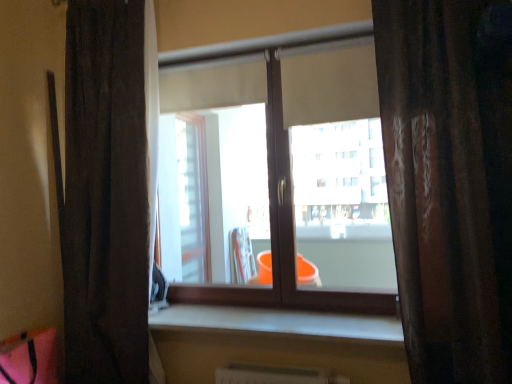
You are a GUI agent. You are given a task and a screenshot of the screen. Output one action in this format:
    pyautogui.click(x=<x>, y=<y>)
    Task: Click on the smooth concrete window sill at center
    This screenshot has width=512, height=384.
    Given the screenshot: What is the action you would take?
    pyautogui.click(x=279, y=323)

How much space does dark fabric curtain at left, placed as the 1th curtain when sorted from back to front, occupy horizontally?

dark fabric curtain at left, placed as the 1th curtain when sorted from back to front, is 7.59 inches wide.

Where is `smooth concrete window sill at center`? smooth concrete window sill at center is located at coordinates (279, 323).

Could you tell me if transparent glass window at center is turned towards brown textured curtain at right, arranged as the 2th curtain when viewed from the back?

No, transparent glass window at center is not oriented towards brown textured curtain at right, arranged as the 2th curtain when viewed from the back.

Based on the photo, considering the relative positions of transparent glass window at center and brown textured curtain at right, the second curtain when ordered from left to right, in the image provided, is transparent glass window at center to the right of brown textured curtain at right, the second curtain when ordered from left to right, from the viewer's perspective?

Incorrect, transparent glass window at center is not on the right side of brown textured curtain at right, the second curtain when ordered from left to right.

Can you confirm if transparent glass window at center is shorter than brown textured curtain at right, acting as the 1th curtain starting from the right?

Yes, transparent glass window at center is shorter than brown textured curtain at right, acting as the 1th curtain starting from the right.

From the image's perspective, which one is positioned higher, brown textured curtain at right, acting as the 1th curtain starting from the right, or dark fabric curtain at left, the 2th curtain in the right-to-left sequence?

brown textured curtain at right, acting as the 1th curtain starting from the right, from the image's perspective.

Considering the sizes of objects brown textured curtain at right, arranged as the 2th curtain when viewed from the back, and dark fabric curtain at left, the 1th curtain viewed from the left, in the image provided, who is taller, brown textured curtain at right, arranged as the 2th curtain when viewed from the back, or dark fabric curtain at left, the 1th curtain viewed from the left,?

With more height is dark fabric curtain at left, the 1th curtain viewed from the left.

Based on the photo, considering the relative sizes of brown textured curtain at right, the second curtain when ordered from left to right, and dark fabric curtain at left, which ranks as the second curtain in front-to-back order, in the image provided, is brown textured curtain at right, the second curtain when ordered from left to right, wider than dark fabric curtain at left, which ranks as the second curtain in front-to-back order,?

Indeed, brown textured curtain at right, the second curtain when ordered from left to right, has a greater width compared to dark fabric curtain at left, which ranks as the second curtain in front-to-back order.

Considering the relative sizes of dark fabric curtain at left, the 1th curtain viewed from the left, and transparent glass window at center in the image provided, is dark fabric curtain at left, the 1th curtain viewed from the left, smaller than transparent glass window at center?

Actually, dark fabric curtain at left, the 1th curtain viewed from the left, might be larger than transparent glass window at center.

From a real-world perspective, is dark fabric curtain at left, the 2th curtain in the right-to-left sequence, above or below transparent glass window at center?

From a real-world perspective, dark fabric curtain at left, the 2th curtain in the right-to-left sequence, is physically below transparent glass window at center.

What's the angular difference between dark fabric curtain at left, which ranks as the second curtain in front-to-back order, and transparent glass window at center's facing directions?

They differ by 0.617 degrees in their facing directions.

From the picture: Which of these two, dark fabric curtain at left, the 1th curtain viewed from the left, or transparent glass window at center, stands taller?

dark fabric curtain at left, the 1th curtain viewed from the left.

Locate an element on the screen. curtain that appears in front of the smooth concrete window sill at center is located at coordinates (449, 181).

Is brown textured curtain at right, the first curtain from the front, aimed at smooth concrete window sill at center?

No.

Is point (432, 166) closer or farther from the camera than point (305, 315)?

Point (432, 166).

Can you confirm if brown textured curtain at right, arranged as the 2th curtain when viewed from the back, is thinner than smooth concrete window sill at center?

Incorrect, the width of brown textured curtain at right, arranged as the 2th curtain when viewed from the back, is not less than that of smooth concrete window sill at center.

From the image's perspective, does smooth concrete window sill at center appear higher than brown textured curtain at right, the first curtain from the front?

No.

Considering the sizes of smooth concrete window sill at center and brown textured curtain at right, arranged as the 2th curtain when viewed from the back, in the image, is smooth concrete window sill at center wider or thinner than brown textured curtain at right, arranged as the 2th curtain when viewed from the back,?

Considering their sizes, smooth concrete window sill at center looks slimmer than brown textured curtain at right, arranged as the 2th curtain when viewed from the back.

Which is more to the right, smooth concrete window sill at center or brown textured curtain at right, the first curtain from the front?

brown textured curtain at right, the first curtain from the front, is more to the right.

Considering the positions of point (415, 13) and point (220, 106), is point (415, 13) closer or farther from the camera than point (220, 106)?

Point (415, 13) is closer to the camera than point (220, 106).

What's the angular difference between brown textured curtain at right, arranged as the 2th curtain when viewed from the back, and transparent glass window at center's facing directions?

There is a 0.618-degree angle between the facing directions of brown textured curtain at right, arranged as the 2th curtain when viewed from the back, and transparent glass window at center.

Find the location of a particular element. This screenshot has height=384, width=512. curtain that is on the right side of transparent glass window at center is located at coordinates (449, 181).

Is brown textured curtain at right, acting as the 1th curtain starting from the right, taller than transparent glass window at center?

Indeed, brown textured curtain at right, acting as the 1th curtain starting from the right, has a greater height compared to transparent glass window at center.

From the image's perspective, which one is positioned lower, dark fabric curtain at left, the 2th curtain in the right-to-left sequence, or brown textured curtain at right, the first curtain from the front?

dark fabric curtain at left, the 2th curtain in the right-to-left sequence.

Is dark fabric curtain at left, the 2th curtain in the right-to-left sequence, taller or shorter than brown textured curtain at right, acting as the 1th curtain starting from the right?

Considering their sizes, dark fabric curtain at left, the 2th curtain in the right-to-left sequence, has more height than brown textured curtain at right, acting as the 1th curtain starting from the right.

Are dark fabric curtain at left, placed as the 1th curtain when sorted from back to front, and brown textured curtain at right, arranged as the 2th curtain when viewed from the back, making contact?

dark fabric curtain at left, placed as the 1th curtain when sorted from back to front, and brown textured curtain at right, arranged as the 2th curtain when viewed from the back, are clearly separated.

Where is `window lying behind the brown textured curtain at right, arranged as the 2th curtain when viewed from the back`? Image resolution: width=512 pixels, height=384 pixels. window lying behind the brown textured curtain at right, arranged as the 2th curtain when viewed from the back is located at coordinates (301, 165).

You are a GUI agent. You are given a task and a screenshot of the screen. Output one action in this format:
    pyautogui.click(x=<x>, y=<y>)
    Task: Click on the curtain on the right of the dark fabric curtain at left, the 2th curtain in the right-to-left sequence
    The width and height of the screenshot is (512, 384).
    Given the screenshot: What is the action you would take?
    pyautogui.click(x=449, y=181)

From the image, which object appears to be nearer to smooth concrete window sill at center, brown textured curtain at right, acting as the 1th curtain starting from the right, or transparent glass window at center?

transparent glass window at center is positioned closer to the anchor smooth concrete window sill at center.

Estimate the real-world distances between objects in this image. Which object is further from brown textured curtain at right, arranged as the 2th curtain when viewed from the back, transparent glass window at center or dark fabric curtain at left, the 1th curtain viewed from the left?

dark fabric curtain at left, the 1th curtain viewed from the left, is further to brown textured curtain at right, arranged as the 2th curtain when viewed from the back.

Estimate the real-world distances between objects in this image. Which object is further from smooth concrete window sill at center, transparent glass window at center or brown textured curtain at right, the first curtain from the front?

brown textured curtain at right, the first curtain from the front, lies further to smooth concrete window sill at center than the other object.

From the picture: Which object lies further to the anchor point brown textured curtain at right, the second curtain when ordered from left to right, dark fabric curtain at left, which ranks as the second curtain in front-to-back order, or transparent glass window at center?

dark fabric curtain at left, which ranks as the second curtain in front-to-back order, lies further to brown textured curtain at right, the second curtain when ordered from left to right, than the other object.

When comparing their distances from dark fabric curtain at left, placed as the 1th curtain when sorted from back to front, does transparent glass window at center or smooth concrete window sill at center seem further?

Among the two, smooth concrete window sill at center is located further to dark fabric curtain at left, placed as the 1th curtain when sorted from back to front.

Looking at this image, based on their spatial positions, is dark fabric curtain at left, placed as the 1th curtain when sorted from back to front, or brown textured curtain at right, the first curtain from the front, closer to transparent glass window at center?

Among the two, brown textured curtain at right, the first curtain from the front, is located nearer to transparent glass window at center.

Looking at the image, which one is located closer to transparent glass window at center, smooth concrete window sill at center or brown textured curtain at right, arranged as the 2th curtain when viewed from the back?

The object closer to transparent glass window at center is smooth concrete window sill at center.

Which object lies nearer to the anchor point brown textured curtain at right, the second curtain when ordered from left to right, smooth concrete window sill at center or transparent glass window at center?

transparent glass window at center is closer to brown textured curtain at right, the second curtain when ordered from left to right.

Where is `window between dark fabric curtain at left, which ranks as the second curtain in front-to-back order, and brown textured curtain at right, the first curtain from the front, in the horizontal direction`? window between dark fabric curtain at left, which ranks as the second curtain in front-to-back order, and brown textured curtain at right, the first curtain from the front, in the horizontal direction is located at coordinates (301, 165).

Where is `window sill located between dark fabric curtain at left, placed as the 1th curtain when sorted from back to front, and brown textured curtain at right, the first curtain from the front, in the left-right direction`? window sill located between dark fabric curtain at left, placed as the 1th curtain when sorted from back to front, and brown textured curtain at right, the first curtain from the front, in the left-right direction is located at coordinates (279, 323).

Identify the location of window between dark fabric curtain at left, the 2th curtain in the right-to-left sequence, and smooth concrete window sill at center. tap(301, 165).